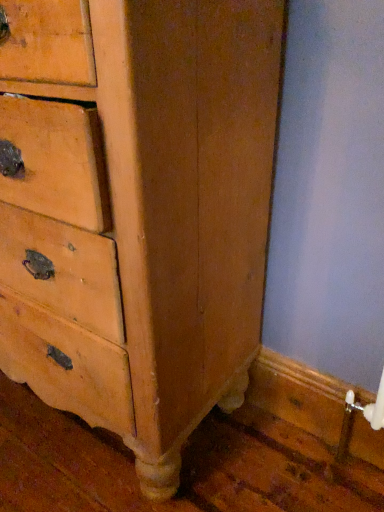
This screenshot has height=512, width=384. Describe the element at coordinates (136, 210) in the screenshot. I see `wooden dresser at lower left` at that location.

At what (x,y) coordinates should I click in order to perform the action: click on wooden dresser at lower left. Please return your answer as a coordinate pair (x, y). Looking at the image, I should click on (136, 210).

Identify the location of wooden dresser at lower left. (136, 210).